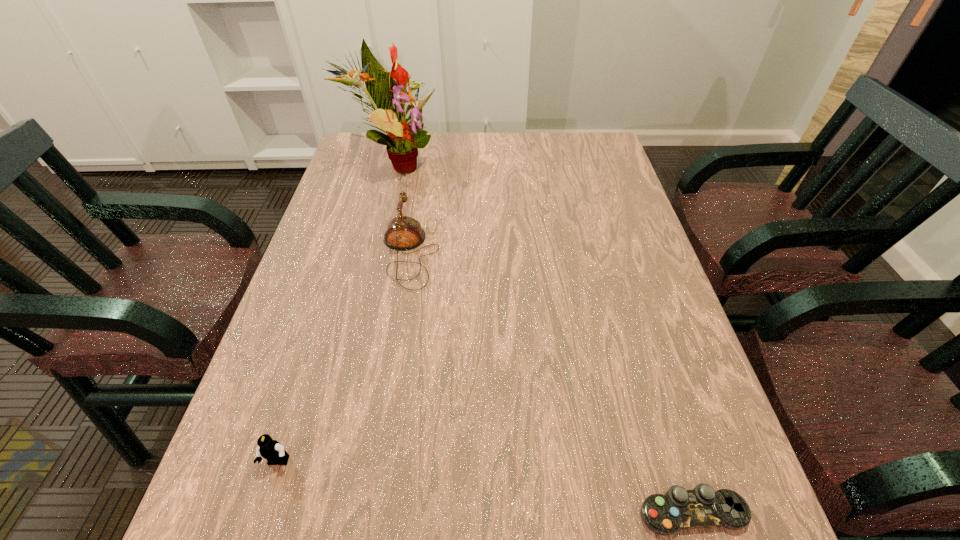
The width and height of the screenshot is (960, 540). Find the location of `the tallest object`. the tallest object is located at coordinates (387, 92).

At what (x,y) coordinates should I click in order to perform the action: click on bouquet. Please return your answer as a coordinate pair (x, y). This screenshot has width=960, height=540. Looking at the image, I should click on (387, 92).

Identify the location of telephone. This screenshot has width=960, height=540. (403, 233).

This screenshot has width=960, height=540. Identify the location of the third shortest object. (403, 233).

Image resolution: width=960 pixels, height=540 pixels. I want to click on the third farthest object, so click(x=271, y=450).

Locate an element on the screen. The image size is (960, 540). Lego is located at coordinates (271, 450).

Where is `the nearest object`? the nearest object is located at coordinates (679, 509).

Image resolution: width=960 pixels, height=540 pixels. Find the location of `the rightmost object`. the rightmost object is located at coordinates (679, 509).

Locate an element on the screen. vacant area located on the front-facing side of the farthest object is located at coordinates (490, 164).

The width and height of the screenshot is (960, 540). Find the location of `blank space located 0.090m on the rotary dial of the telephone`. blank space located 0.090m on the rotary dial of the telephone is located at coordinates (475, 253).